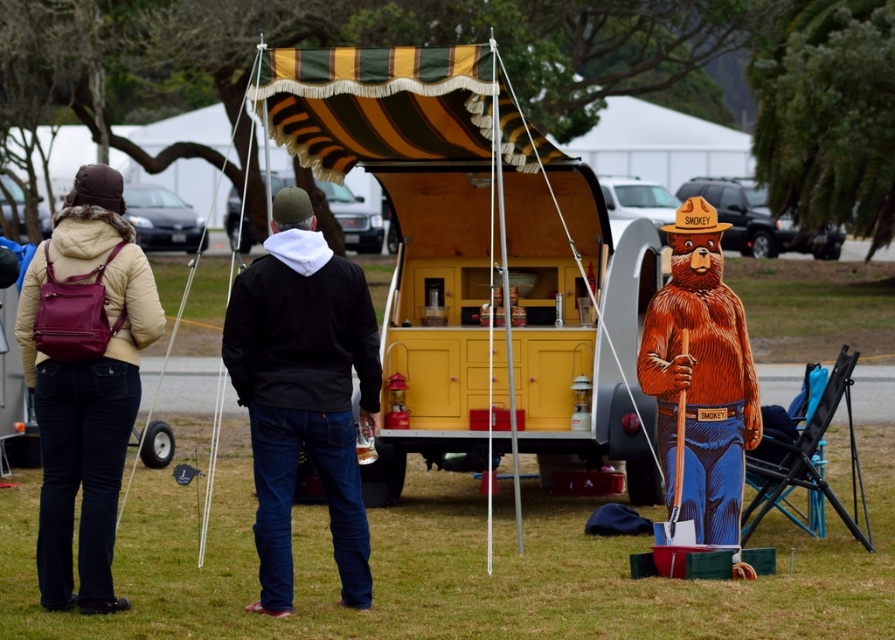
Question: Is black hoodie at center below wooden bear at center?

Choices:
 (A) yes
 (B) no

Answer: (B)

Question: Among these points, which one is farthest from the camera?

Choices:
 (A) (599, 381)
 (B) (667, 404)
 (C) (322, 320)
 (D) (112, 518)

Answer: (A)

Question: Considering the real-world distances, which object is closest to the wooden bear at center?

Choices:
 (A) yellow wood food truck at center
 (B) black hoodie at center
 (C) matte brown backpack at left

Answer: (B)

Question: Which point is closer to the camera?

Choices:
 (A) (708, 305)
 (B) (61, 360)
 (C) (448, 262)
 (D) (240, 342)

Answer: (B)

Question: Is matte brown backpack at left to the right of wooden bear at center from the viewer's perspective?

Choices:
 (A) no
 (B) yes

Answer: (A)

Question: Can you confirm if yellow wood food truck at center is positioned below matte brown backpack at left?

Choices:
 (A) no
 (B) yes

Answer: (A)